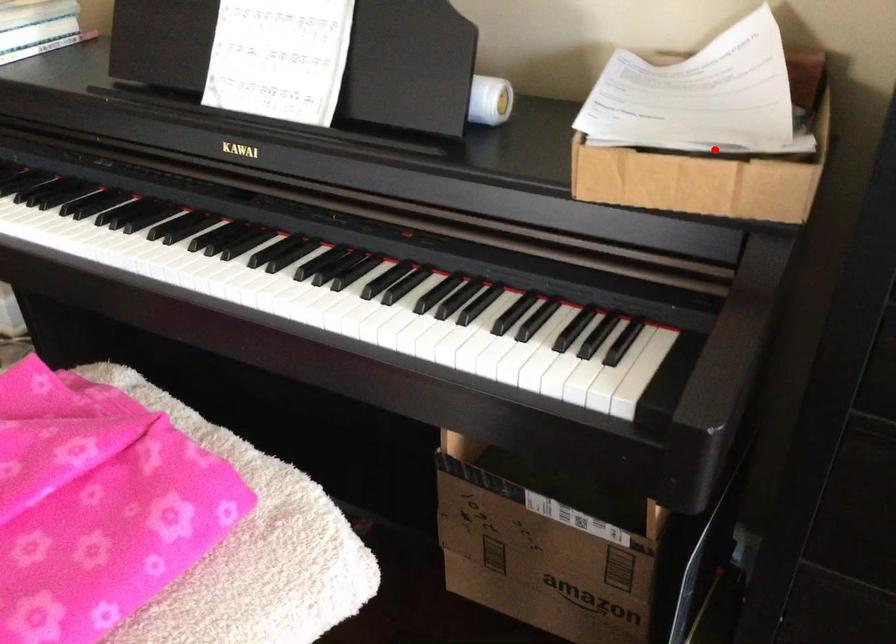
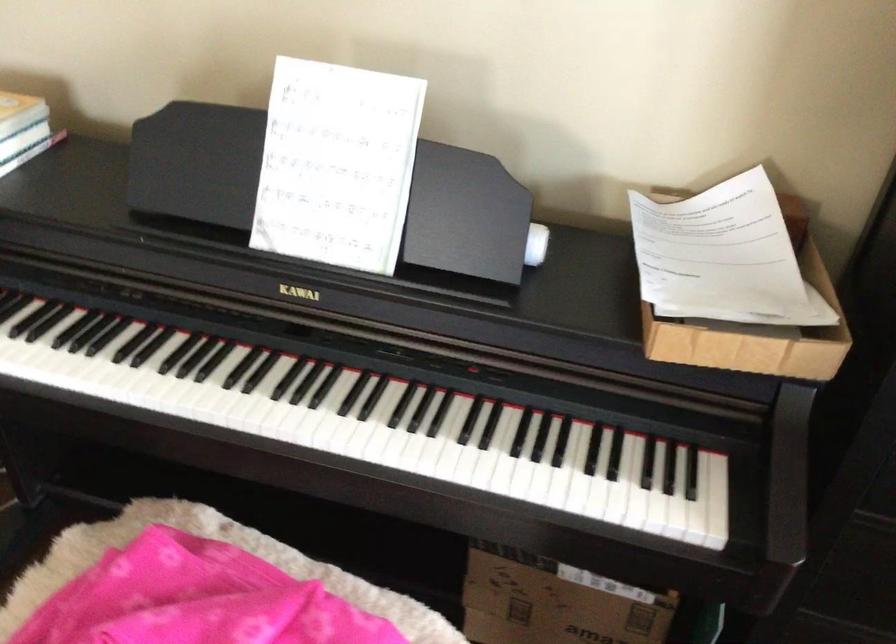
Question: I am providing you with two images of the same scene from different viewpoints. In image1, a red point is highlighted. Considering the same 3D point in image2, which of the following is correct?

Choices:
 (A) It is closer
 (B) It is farther

Answer: (B)